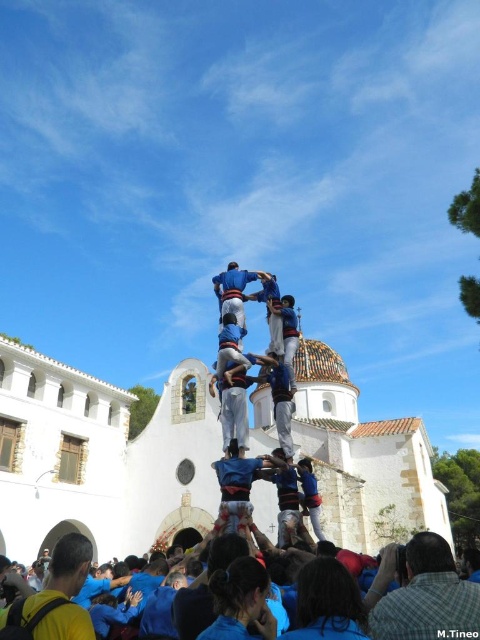
Is blue shirt at lower center wider than blue fabric crowd at lower center?

In fact, blue shirt at lower center might be narrower than blue fabric crowd at lower center.

Can you confirm if blue shirt at lower center is positioned below blue fabric crowd at lower center?

Incorrect, blue shirt at lower center is not positioned below blue fabric crowd at lower center.

Is point (381, 609) farther from viewer compared to point (47, 627)?

Yes, point (381, 609) is behind point (47, 627).

This screenshot has width=480, height=640. Identify the location of blue shirt at lower center. (429, 596).

Which is above, blue shirt at lower center or yellow shirt at lower left?

yellow shirt at lower left

Is blue shirt at lower center shorter than yellow shirt at lower left?

Incorrect, blue shirt at lower center's height does not fall short of yellow shirt at lower left's.

Is point (459, 580) farther from viewer compared to point (52, 593)?

Yes, it is behind point (52, 593).

At what (x,y) coordinates should I click in order to perform the action: click on blue shirt at lower center. Please return your answer as a coordinate pair (x, y). Image resolution: width=480 pixels, height=640 pixels. Looking at the image, I should click on (429, 596).

This screenshot has height=640, width=480. Describe the element at coordinates (62, 572) in the screenshot. I see `blue fabric crowd at lower center` at that location.

Can you confirm if blue fabric crowd at lower center is positioned below yellow shirt at lower left?

Correct, blue fabric crowd at lower center is located below yellow shirt at lower left.

Between point (76, 620) and point (66, 593), which one is positioned behind?

The point (66, 593) is more distant.

Find the location of a particular element. This screenshot has width=480, height=640. blue fabric crowd at lower center is located at coordinates (62, 572).